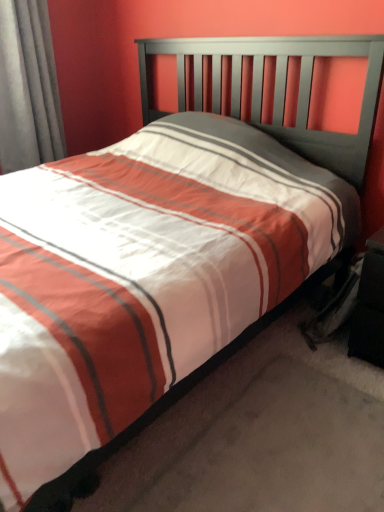
Question: Is gray fabric curtain at left inside or outside of black fabric nightstand at lower right?

Choices:
 (A) outside
 (B) inside

Answer: (A)

Question: Is point (23, 111) positioned closer to the camera than point (380, 247)?

Choices:
 (A) closer
 (B) farther

Answer: (B)

Question: In terms of width, does gray fabric curtain at left look wider or thinner when compared to black fabric nightstand at lower right?

Choices:
 (A) thin
 (B) wide

Answer: (A)

Question: Is point (362, 296) closer or farther from the camera than point (51, 88)?

Choices:
 (A) closer
 (B) farther

Answer: (A)

Question: Considering their positions, is black fabric nightstand at lower right located in front of or behind gray fabric curtain at left?

Choices:
 (A) behind
 (B) front

Answer: (B)

Question: In terms of height, does black fabric nightstand at lower right look taller or shorter compared to gray fabric curtain at left?

Choices:
 (A) tall
 (B) short

Answer: (B)

Question: From a real-world perspective, relative to gray fabric curtain at left, is black fabric nightstand at lower right vertically above or below?

Choices:
 (A) below
 (B) above

Answer: (A)